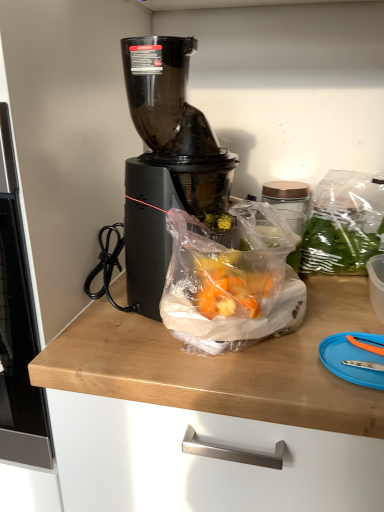
From the picture: Measure the distance between black plastic blender at center and camera.

The distance of black plastic blender at center from camera is 24.44 inches.

Find the location of a particular element. The height and width of the screenshot is (512, 384). black plastic blender at center is located at coordinates tap(165, 161).

Based on their positions, is black plastic blender at center located to the left or right of blue plastic cutting board at lower right?

In the image, black plastic blender at center appears on the left side of blue plastic cutting board at lower right.

In terms of height, does black plastic blender at center look taller or shorter compared to blue plastic cutting board at lower right?

Clearly, black plastic blender at center is taller compared to blue plastic cutting board at lower right.

Is point (136, 164) farther from viewer compared to point (362, 360)?

Yes, it is.

Is blue plastic cutting board at lower right at the back of black plastic blender at center?

No, black plastic blender at center's orientation is not away from blue plastic cutting board at lower right.

How much distance is there between blue plastic cutting board at lower right and black plastic blender at center?

blue plastic cutting board at lower right is 14.57 inches from black plastic blender at center.

Which of these two, blue plastic cutting board at lower right or black plastic blender at center, is smaller?

With smaller size is blue plastic cutting board at lower right.

From the image's perspective, is blue plastic cutting board at lower right located beneath black plastic blender at center?

Yes.

From a real-world perspective, between blue plastic cutting board at lower right and black plastic blender at center, who is vertically lower?

In real-world perspective, blue plastic cutting board at lower right is lower.

Does translucent plastic bag at center come in front of black plastic blender at center?

Yes, it is in front of black plastic blender at center.

Would you say black plastic blender at center is part of translucent plastic bag at center's contents?

No.

From the image's perspective, which object appears higher, translucent plastic bag at center or black plastic blender at center?

black plastic blender at center, from the image's perspective.

Is point (324, 360) farther from viewer compared to point (277, 282)?

No, it is not.

Considering the sizes of objects blue plastic cutting board at lower right and translucent plastic bag at center in the image provided, who is shorter, blue plastic cutting board at lower right or translucent plastic bag at center?

With less height is blue plastic cutting board at lower right.

Between blue plastic cutting board at lower right and translucent plastic bag at center, which one has smaller width?

blue plastic cutting board at lower right.

Is blue plastic cutting board at lower right far from translucent plastic bag at center?

blue plastic cutting board at lower right is near translucent plastic bag at center, not far away.

In terms of size, does black plastic blender at center appear bigger or smaller than translucent plastic bag at center?

Clearly, black plastic blender at center is larger in size than translucent plastic bag at center.

Find the location of a particular element. The width and height of the screenshot is (384, 512). waste below the black plastic blender at center (from the image's perspective) is located at coordinates (231, 283).

Based on the photo, is black plastic blender at center surrounding translucent plastic bag at center?

Yes, translucent plastic bag at center can be found within black plastic blender at center.

What's the angular difference between black plastic blender at center and translucent plastic bag at center's facing directions?

They differ by 1.3 degrees in their facing directions.

The width and height of the screenshot is (384, 512). I want to click on waste above the blue plastic cutting board at lower right (from the image's perspective), so click(x=231, y=283).

Is blue plastic cutting board at lower right surrounded by translucent plastic bag at center?

That's incorrect, blue plastic cutting board at lower right is not inside translucent plastic bag at center.

From a real-world perspective, which object stands above the other?

translucent plastic bag at center, from a real-world perspective.

Does translucent plastic bag at center lie in front of blue plastic cutting board at lower right?

Yes.

Locate an element on the screen. blender positioned vertically above the blue plastic cutting board at lower right (from a real-world perspective) is located at coordinates (165, 161).

Find the location of `cutting board in front of the black plastic blender at center`. cutting board in front of the black plastic blender at center is located at coordinates (352, 358).

Based on their spatial positions, is translucent plastic bag at center or black plastic blender at center further from blue plastic cutting board at lower right?

Among the two, black plastic blender at center is located further to blue plastic cutting board at lower right.

Considering their positions, is black plastic blender at center positioned further to blue plastic cutting board at lower right than translucent plastic bag at center?

black plastic blender at center is further to blue plastic cutting board at lower right.

Estimate the real-world distances between objects in this image. Which object is further from translucent plastic bag at center, blue plastic cutting board at lower right or black plastic blender at center?

blue plastic cutting board at lower right is positioned further to the anchor translucent plastic bag at center.

Which object lies nearer to the anchor point translucent plastic bag at center, black plastic blender at center or blue plastic cutting board at lower right?

black plastic blender at center lies closer to translucent plastic bag at center than the other object.

Based on their spatial positions, is translucent plastic bag at center or blue plastic cutting board at lower right further from black plastic blender at center?

blue plastic cutting board at lower right.

When comparing their distances from black plastic blender at center, does blue plastic cutting board at lower right or translucent plastic bag at center seem further?

blue plastic cutting board at lower right is positioned further to the anchor black plastic blender at center.

Image resolution: width=384 pixels, height=512 pixels. I want to click on waste between black plastic blender at center and blue plastic cutting board at lower right in the up-down direction, so click(231, 283).